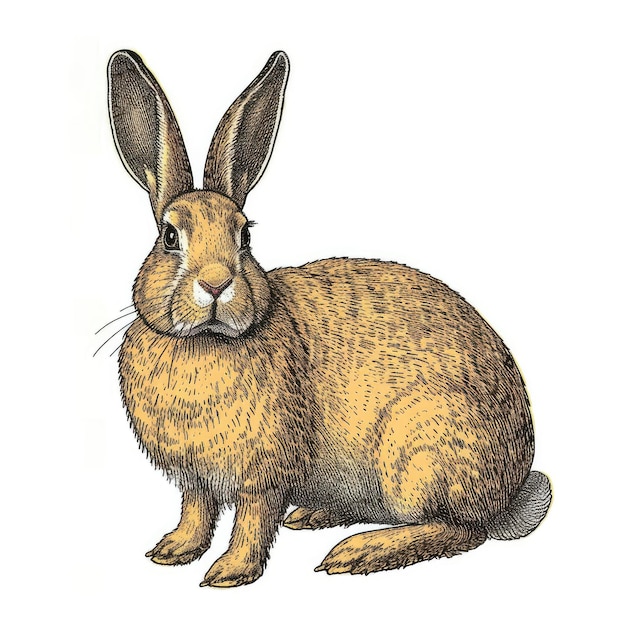
The height and width of the screenshot is (626, 626). Identify the location of left front leg. (270, 539).